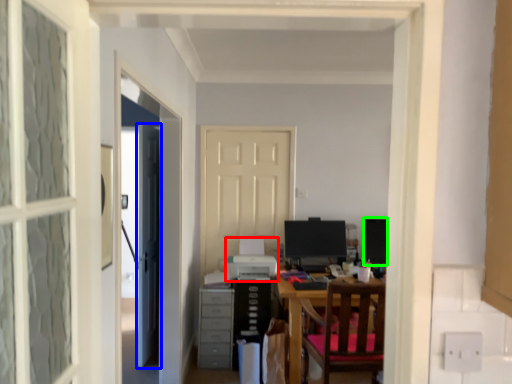
Question: Which is farther away from printer (highlighted by a red box)? door (highlighted by a blue box) or computer monitor (highlighted by a green box)?

Choices:
 (A) door
 (B) computer monitor

Answer: (B)